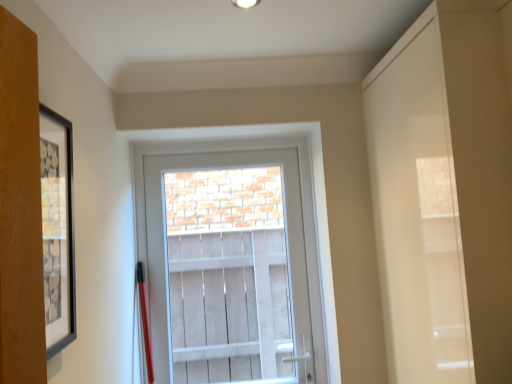
Question: Are black matte picture frame at left and white glossy door at right far apart?

Choices:
 (A) yes
 (B) no

Answer: (B)

Question: From the image's perspective, is black matte picture frame at left above white glossy door at right?

Choices:
 (A) no
 (B) yes

Answer: (B)

Question: Would you say black matte picture frame at left is outside white glossy door at right?

Choices:
 (A) no
 (B) yes

Answer: (B)

Question: Considering the relative positions of black matte picture frame at left and white glossy door at right in the image provided, is black matte picture frame at left behind white glossy door at right?

Choices:
 (A) no
 (B) yes

Answer: (A)

Question: Is black matte picture frame at left smaller than white glossy door at right?

Choices:
 (A) yes
 (B) no

Answer: (A)

Question: Is white glossy door at right spatially inside black matte picture frame at left, or outside of it?

Choices:
 (A) outside
 (B) inside

Answer: (A)

Question: Relative to black matte picture frame at left, is white glossy door at right in front or behind?

Choices:
 (A) behind
 (B) front

Answer: (A)

Question: From their relative heights in the image, would you say white glossy door at right is taller or shorter than black matte picture frame at left?

Choices:
 (A) short
 (B) tall

Answer: (B)

Question: Is point (418, 218) positioned closer to the camera than point (42, 268)?

Choices:
 (A) farther
 (B) closer

Answer: (A)

Question: Is clear glass door at center taller or shorter than white glossy door at right?

Choices:
 (A) tall
 (B) short

Answer: (B)

Question: Choose the correct answer: Is clear glass door at center inside white glossy door at right or outside it?

Choices:
 (A) inside
 (B) outside

Answer: (B)

Question: From the image's perspective, is clear glass door at center located above or below white glossy door at right?

Choices:
 (A) below
 (B) above

Answer: (A)

Question: Is point (224, 334) closer or farther from the camera than point (391, 339)?

Choices:
 (A) farther
 (B) closer

Answer: (A)

Question: In terms of width, does clear glass door at center look wider or thinner when compared to black matte picture frame at left?

Choices:
 (A) wide
 (B) thin

Answer: (A)

Question: Considering the positions of clear glass door at center and black matte picture frame at left in the image, is clear glass door at center taller or shorter than black matte picture frame at left?

Choices:
 (A) short
 (B) tall

Answer: (B)